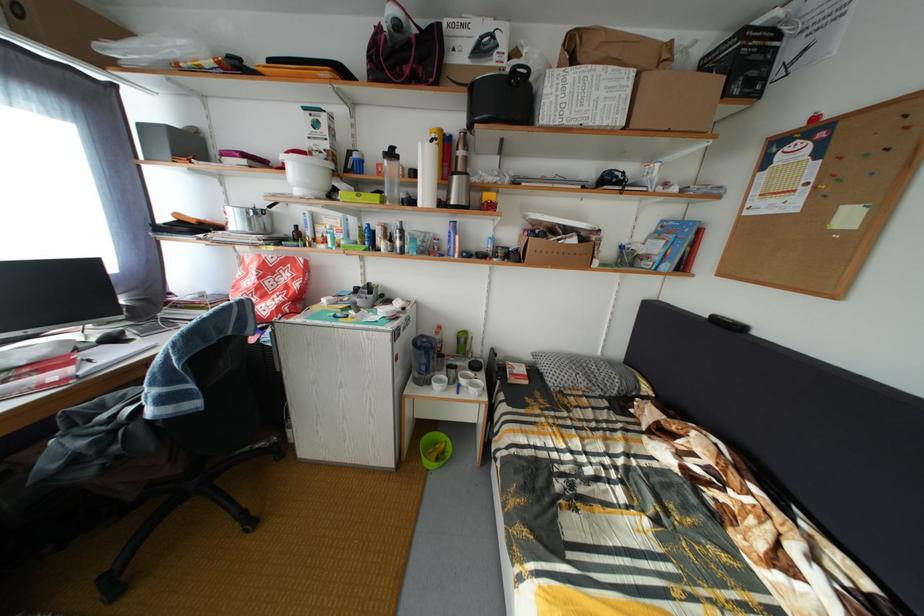
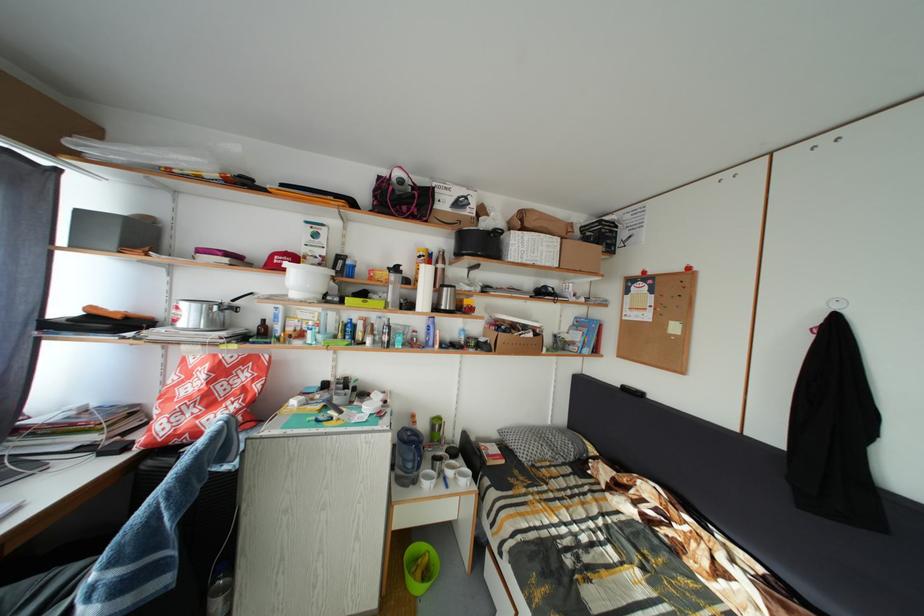
Find the pixel in the second image that matches pixel 465 374 in the first image.

(450, 464)